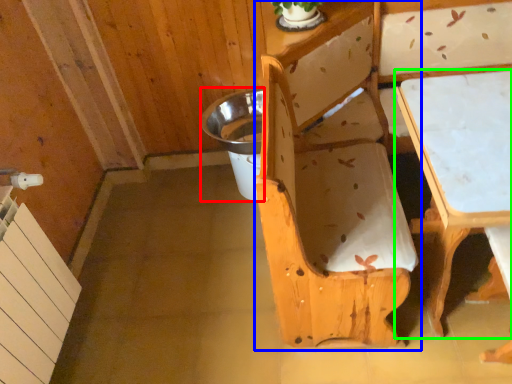
Question: Which is farther away from potty (highlighted by a red box)? chair (highlighted by a blue box) or table (highlighted by a green box)?

Choices:
 (A) chair
 (B) table

Answer: (B)